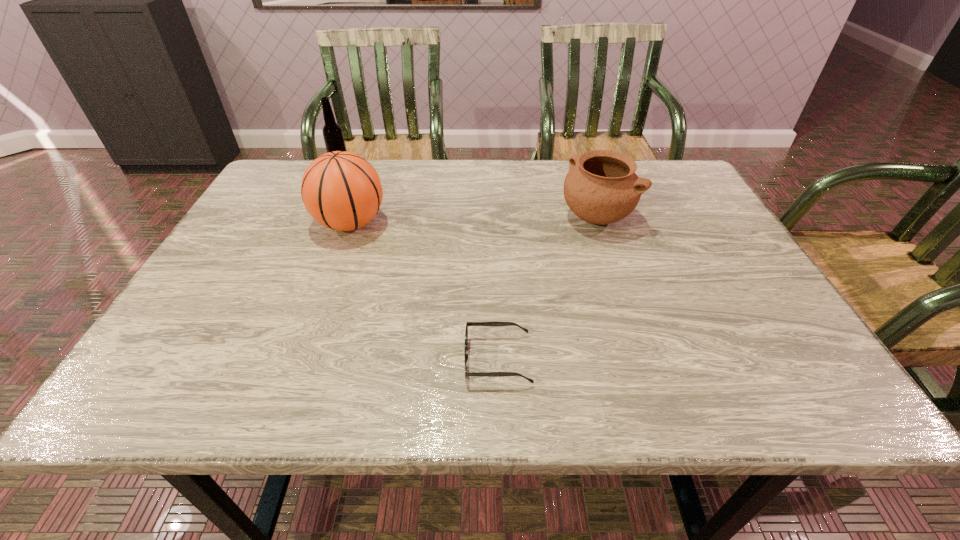
The height and width of the screenshot is (540, 960). In order to click on blank space located at the front lenses of the shortest object in this screenshot , I will do `click(421, 359)`.

I want to click on vacant space positioned 0.280m at the front lenses of the shortest object, so click(x=313, y=359).

The image size is (960, 540). Find the location of `beer bottle that is at the far edge`. beer bottle that is at the far edge is located at coordinates (333, 136).

This screenshot has width=960, height=540. Identify the location of basketball that is at the far edge. (342, 191).

The height and width of the screenshot is (540, 960). I want to click on pottery that is at the far edge, so click(601, 187).

Identify the location of object positioned at the near edge. The width and height of the screenshot is (960, 540). (496, 324).

Image resolution: width=960 pixels, height=540 pixels. I want to click on object that is positioned at the left edge, so click(333, 136).

Where is `object situated at the far left corner`? object situated at the far left corner is located at coordinates (333, 136).

In the image, there is a desktop. Where is `vacant space at the far edge`? vacant space at the far edge is located at coordinates (529, 173).

Where is `blank space at the near edge of the desktop`? The image size is (960, 540). blank space at the near edge of the desktop is located at coordinates (450, 376).